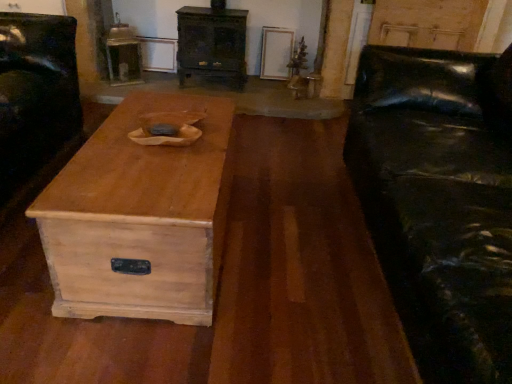
Question: Is light brown wood coffee table at center to the right of wooden chest of drawers at center from the viewer's perspective?

Choices:
 (A) no
 (B) yes

Answer: (A)

Question: Does light brown wood coffee table at center appear on the left side of wooden chest of drawers at center?

Choices:
 (A) no
 (B) yes

Answer: (B)

Question: Does light brown wood coffee table at center have a greater width compared to wooden chest of drawers at center?

Choices:
 (A) yes
 (B) no

Answer: (A)

Question: Is light brown wood coffee table at center oriented away from wooden chest of drawers at center?

Choices:
 (A) yes
 (B) no

Answer: (B)

Question: Considering the relative sizes of light brown wood coffee table at center and wooden chest of drawers at center in the image provided, is light brown wood coffee table at center taller than wooden chest of drawers at center?

Choices:
 (A) no
 (B) yes

Answer: (A)

Question: Does light brown wood coffee table at center have a smaller size compared to wooden chest of drawers at center?

Choices:
 (A) yes
 (B) no

Answer: (B)

Question: Is black leather couch at right wider than black leather armchair at left?

Choices:
 (A) yes
 (B) no

Answer: (A)

Question: Is black leather couch at right positioned in front of black leather armchair at left?

Choices:
 (A) yes
 (B) no

Answer: (A)

Question: Is black leather couch at right at the right side of black leather armchair at left?

Choices:
 (A) yes
 (B) no

Answer: (A)

Question: Considering the relative sizes of black leather couch at right and black leather armchair at left in the image provided, is black leather couch at right taller than black leather armchair at left?

Choices:
 (A) no
 (B) yes

Answer: (B)

Question: Is black leather couch at right further to camera compared to black leather armchair at left?

Choices:
 (A) no
 (B) yes

Answer: (A)

Question: Is black leather couch at right outside black leather armchair at left?

Choices:
 (A) yes
 (B) no

Answer: (A)

Question: Is black leather couch at right at the right side of wooden chest of drawers at center?

Choices:
 (A) yes
 (B) no

Answer: (A)